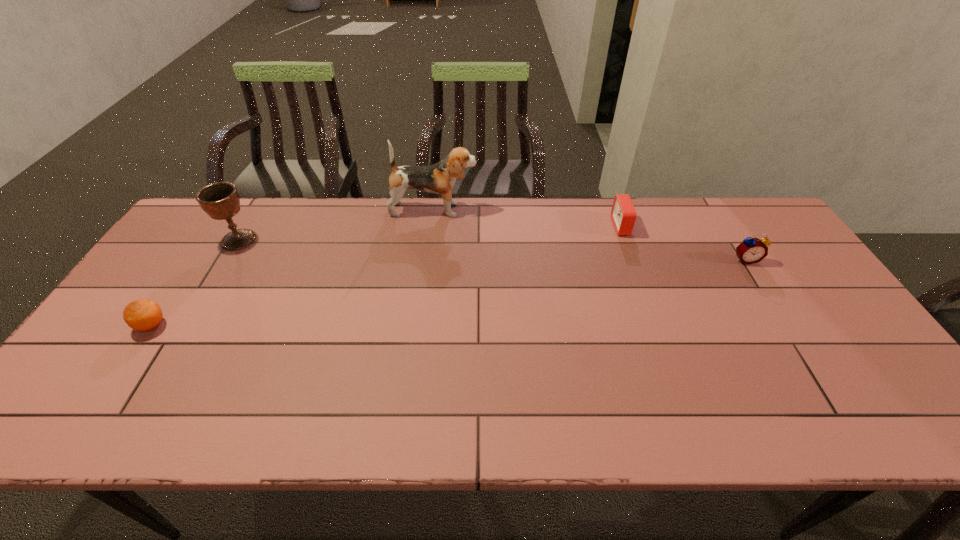
Locate an element on the screen. object at the right edge is located at coordinates (752, 250).

Image resolution: width=960 pixels, height=540 pixels. What are the coordinates of `object that is at the far left corner` in the screenshot? It's located at (220, 200).

I want to click on free location at the far edge, so click(x=710, y=211).

Find the location of a particular element. The height and width of the screenshot is (540, 960). free space at the near edge is located at coordinates (398, 426).

You are a GUI agent. You are given a task and a screenshot of the screen. Output one action in this format:
    pyautogui.click(x=<x>, y=<y>)
    Task: Click on the vacant space at the left edge of the desktop
    This screenshot has width=960, height=540.
    Given the screenshot: What is the action you would take?
    pyautogui.click(x=151, y=281)

The height and width of the screenshot is (540, 960). I want to click on free space at the far left corner of the desktop, so [214, 225].

Locate an element on the screen. This screenshot has height=540, width=960. vacant space at the far right corner of the desktop is located at coordinates (737, 240).

You are a GUI agent. You are given a task and a screenshot of the screen. Output one action in this format:
    pyautogui.click(x=<x>, y=<y>)
    Task: Click on the vacant space at the near right corner of the desktop
    This screenshot has width=960, height=540.
    Given the screenshot: What is the action you would take?
    pyautogui.click(x=919, y=428)

Where is `free space between the orange and the right alarm clock`? This screenshot has height=540, width=960. free space between the orange and the right alarm clock is located at coordinates 448,293.

Locate an element on the screen. free area in between the chalice and the left alarm clock is located at coordinates (430, 233).